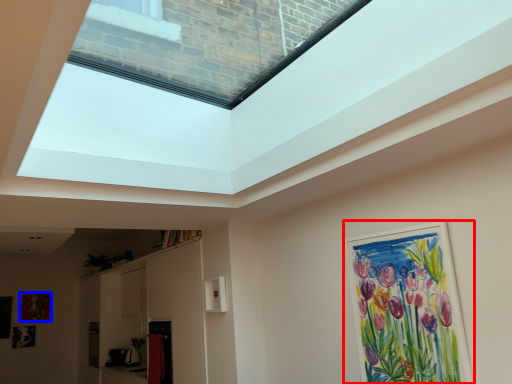
Question: Which point is further to the camera, picture frame (highlighted by a red box) or picture frame (highlighted by a blue box)?

Choices:
 (A) picture frame
 (B) picture frame

Answer: (B)